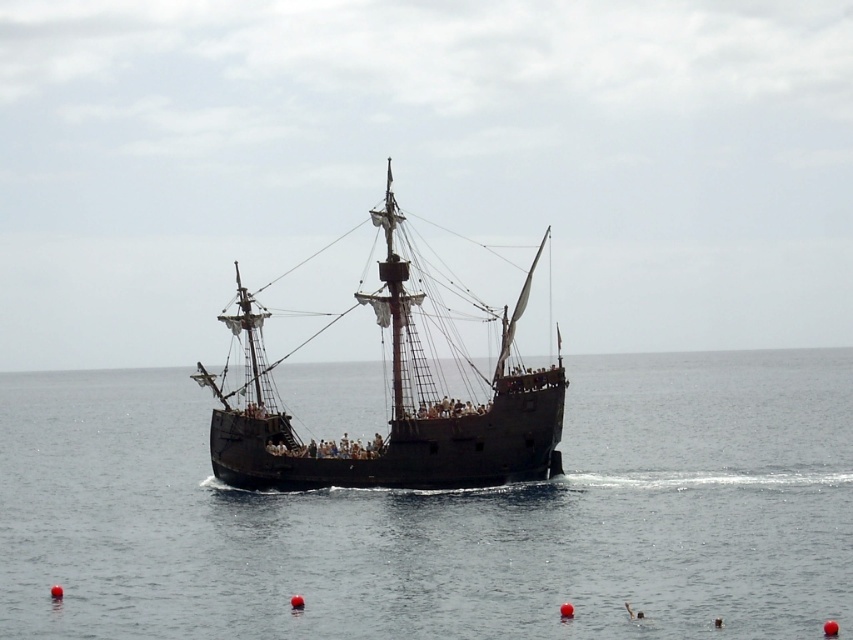
Which is below, black water at center or black wooden pirate ship at center?

Positioned lower is black water at center.

Can you confirm if black water at center is positioned to the right of black wooden pirate ship at center?

Yes, black water at center is to the right of black wooden pirate ship at center.

Is point (294, 538) positioned before point (442, 461)?

Yes, point (294, 538) is in front of point (442, 461).

The height and width of the screenshot is (640, 853). Find the location of `black water at center`. black water at center is located at coordinates (442, 516).